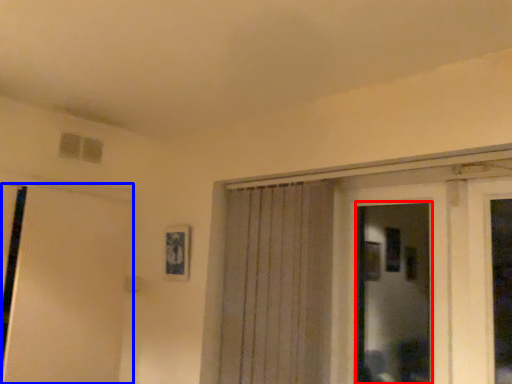
Question: Which object appears farthest to the camera in this image, bay window (highlighted by a red box) or door (highlighted by a blue box)?

Choices:
 (A) bay window
 (B) door

Answer: (B)